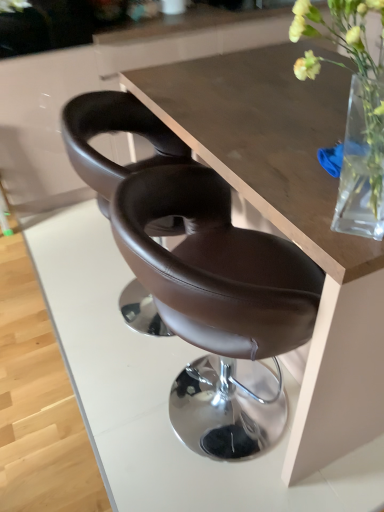
Where is `vacant space in brown leather chair at center, the 2th chair when ordered from back to front (from a real-world perspective)`? vacant space in brown leather chair at center, the 2th chair when ordered from back to front (from a real-world perspective) is located at coordinates (187, 425).